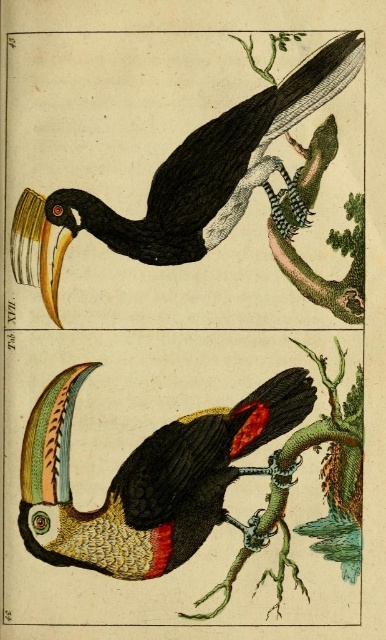
Question: Which object is positioned farthest from the matte black toucan at upper center?

Choices:
 (A) multicolored feathered toucan at center
 (B) green textured branch at lower center

Answer: (B)

Question: Which object is positioned farthest from the multicolored feathered toucan at center?

Choices:
 (A) matte black toucan at upper center
 (B) green textured branch at lower center

Answer: (A)

Question: Is matte black toucan at upper center above multicolored feathered toucan at center?

Choices:
 (A) no
 (B) yes

Answer: (B)

Question: Can you confirm if matte black toucan at upper center is smaller than green textured branch at lower center?

Choices:
 (A) no
 (B) yes

Answer: (A)

Question: Which of the following is the farthest from the observer?

Choices:
 (A) matte black toucan at upper center
 (B) green textured branch at lower center
 (C) multicolored feathered toucan at center

Answer: (C)

Question: Does matte black toucan at upper center appear over multicolored feathered toucan at center?

Choices:
 (A) yes
 (B) no

Answer: (A)